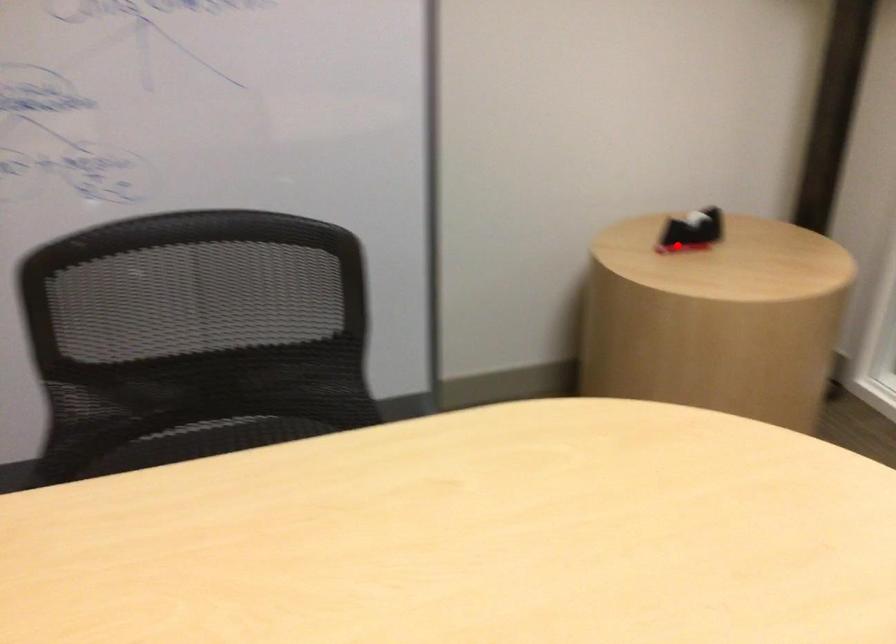
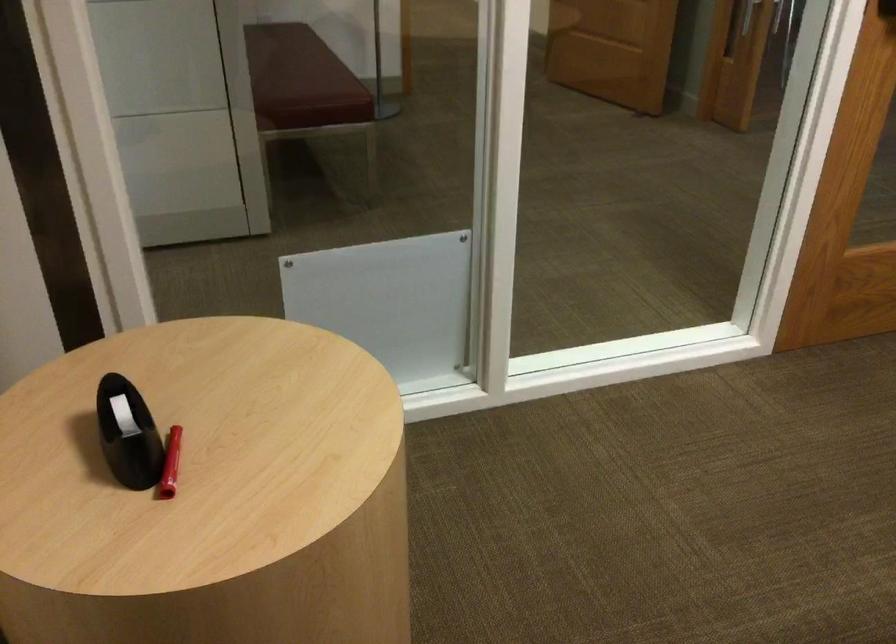
Question: I am providing you with two images of the same scene from different viewpoints. A red point is shown in image1. For the corresponding object point in image2, is it positioned nearer or farther from the camera?

Choices:
 (A) Nearer
 (B) Farther

Answer: (A)